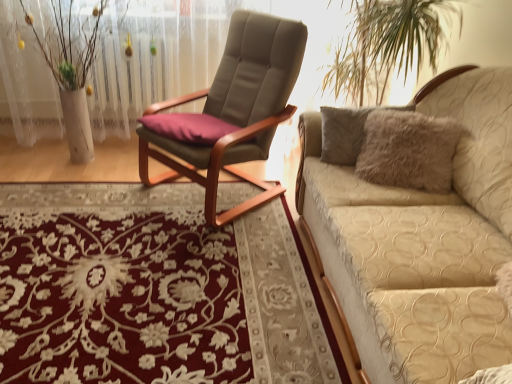
Question: Considering the positions of point pyautogui.click(x=144, y=145) and point pyautogui.click(x=115, y=256), is point pyautogui.click(x=144, y=145) closer or farther from the camera than point pyautogui.click(x=115, y=256)?

Choices:
 (A) closer
 (B) farther

Answer: (B)

Question: From the image's perspective, is suede-like beige chair at center positioned above or below floral carpet at center?

Choices:
 (A) below
 (B) above

Answer: (B)

Question: Considering the real-world distances, which object is closest to the white textured vase at left?

Choices:
 (A) beige quilted couch at right
 (B) floral carpet at center
 (C) suede-like beige chair at center

Answer: (C)

Question: Which object is the farthest from the beige quilted couch at right?

Choices:
 (A) white textured vase at left
 (B) suede-like beige chair at center
 (C) floral carpet at center

Answer: (A)